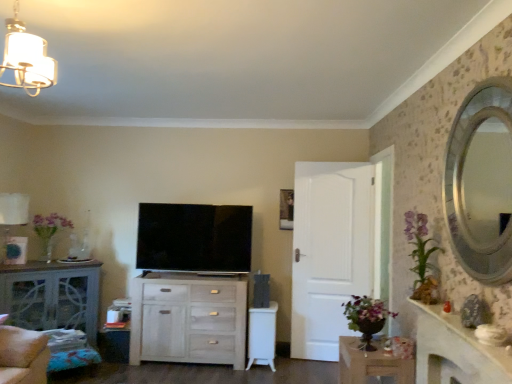
Question: Does white matte door at center appear on the left side of white marble fireplace at right?

Choices:
 (A) no
 (B) yes

Answer: (B)

Question: Is white matte door at center bigger than white marble fireplace at right?

Choices:
 (A) yes
 (B) no

Answer: (A)

Question: Does white matte door at center appear on the right side of white marble fireplace at right?

Choices:
 (A) no
 (B) yes

Answer: (A)

Question: Can you confirm if white matte door at center is shorter than white marble fireplace at right?

Choices:
 (A) yes
 (B) no

Answer: (B)

Question: Is white matte door at center outside white marble fireplace at right?

Choices:
 (A) yes
 (B) no

Answer: (A)

Question: Do you think white fabric lampshade at left, the 1th lamp from the back, is within matte gray cabinet at left, acting as the 2th table starting from the front, or outside of it?

Choices:
 (A) inside
 (B) outside

Answer: (B)

Question: From the image's perspective, is white fabric lampshade at left, the second lamp when ordered from front to back, positioned above or below matte gray cabinet at left, the 2th table positioned from the right?

Choices:
 (A) below
 (B) above

Answer: (B)

Question: In terms of height, does white fabric lampshade at left, the 1th lamp in the left-to-right sequence, look taller or shorter compared to matte gray cabinet at left, the 2th table positioned from the right?

Choices:
 (A) short
 (B) tall

Answer: (A)

Question: Relative to matte gray cabinet at left, the 2th table positioned from the right, is white fabric lampshade at left, the second lamp when ordered from front to back, in front or behind?

Choices:
 (A) behind
 (B) front

Answer: (A)

Question: Is white matte door at center inside the boundaries of wooden picture frame at center, or outside?

Choices:
 (A) inside
 (B) outside

Answer: (B)

Question: From the image's perspective, is white matte door at center above or below wooden picture frame at center?

Choices:
 (A) above
 (B) below

Answer: (B)

Question: Considering the positions of point 333,173 and point 287,205, is point 333,173 closer or farther from the camera than point 287,205?

Choices:
 (A) farther
 (B) closer

Answer: (B)

Question: Would you say white matte door at center is to the left or to the right of wooden picture frame at center in the picture?

Choices:
 (A) right
 (B) left

Answer: (A)

Question: From the image's perspective, relative to white matte door at center, is matte gray cabinet at left, which ranks as the 1th table in left-to-right order, above or below?

Choices:
 (A) below
 (B) above

Answer: (A)

Question: In terms of size, does matte gray cabinet at left, acting as the 2th table starting from the front, appear bigger or smaller than white matte door at center?

Choices:
 (A) small
 (B) big

Answer: (B)